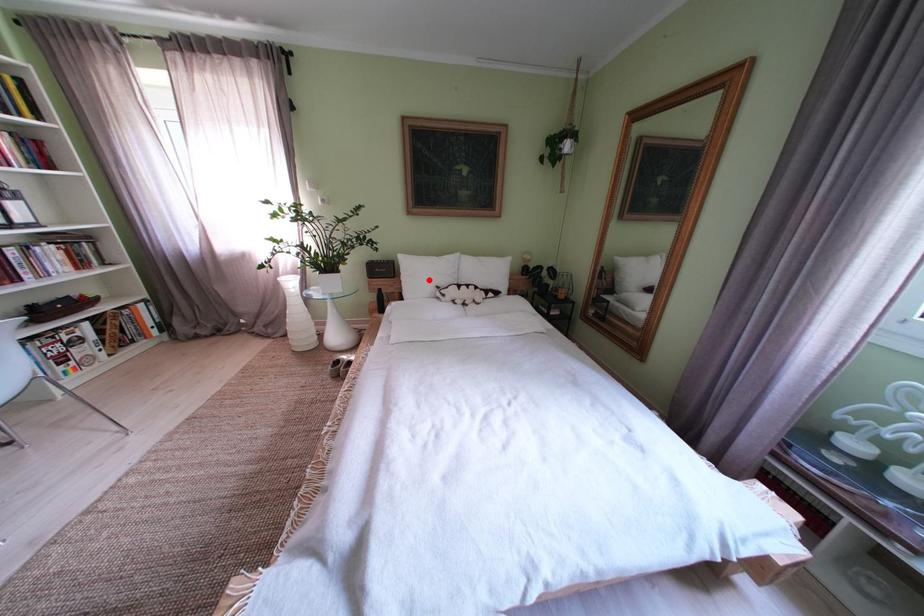
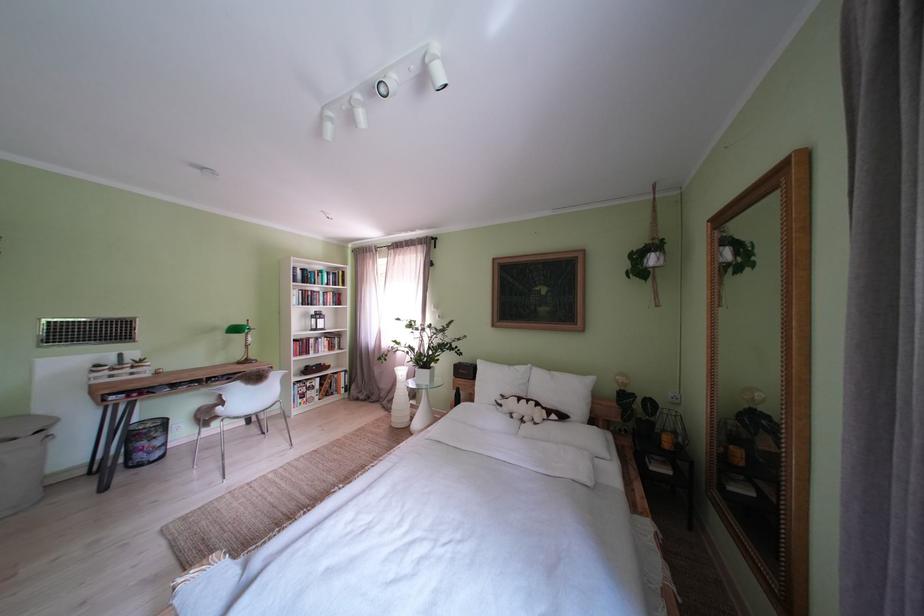
Find the pixel in the second image that matches the highlighted location in the first image.

(500, 386)